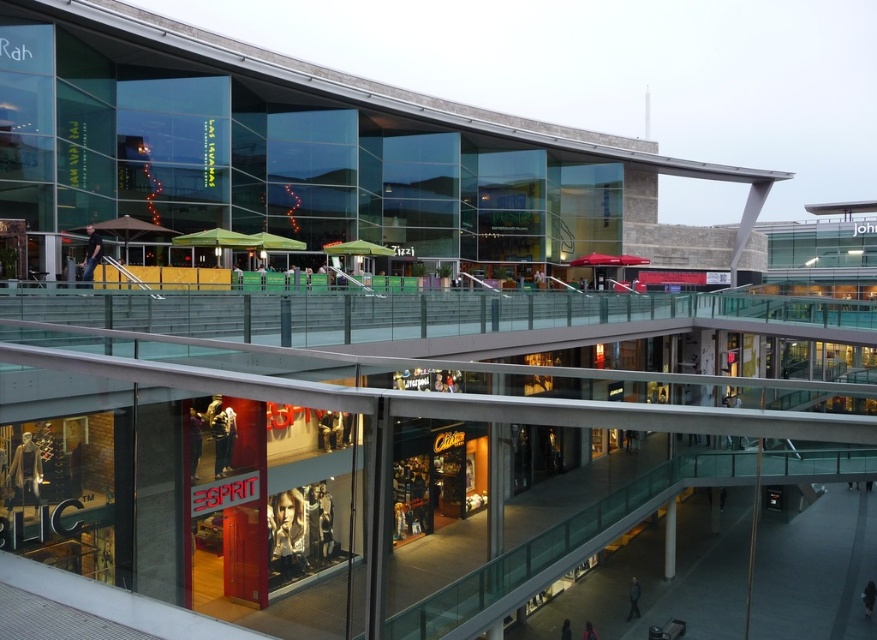
Question: Is dark blue jeans at lower left smaller than black fabric person at lower right?

Choices:
 (A) no
 (B) yes

Answer: (A)

Question: Which point is farther from the camera taking this photo?

Choices:
 (A) click(298, 522)
 (B) click(637, 604)
 (C) click(225, 445)
 (D) click(594, 630)

Answer: (B)

Question: Which point is farther to the camera?

Choices:
 (A) dark blue jeans at lower center
 (B) metallic silver poster at center

Answer: (A)

Question: Can you confirm if matte brown leather jacket at lower left is positioned above dark blue jeans at lower left?

Choices:
 (A) no
 (B) yes

Answer: (A)

Question: Can you confirm if black fabric person at lower right is positioned below dark blue jeans at lower center?

Choices:
 (A) yes
 (B) no

Answer: (B)

Question: Among these objects, which one is farthest from the camera?

Choices:
 (A) matte black jacket at center
 (B) dark blue jeans at lower center

Answer: (B)